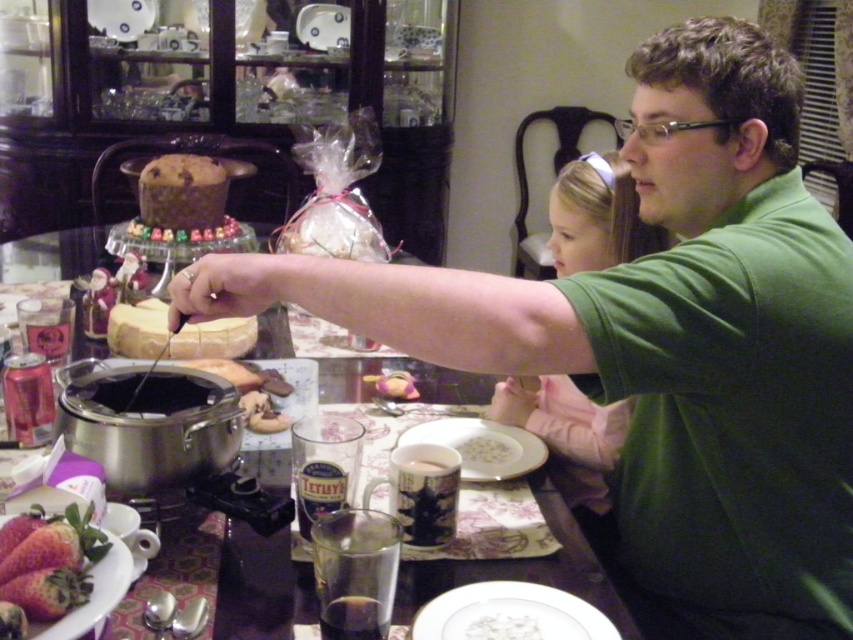
Question: Does white ceramic mug at center appear on the left side of white matte plate at center?

Choices:
 (A) yes
 (B) no

Answer: (A)

Question: Which of the following is the farthest from the observer?

Choices:
 (A) white ceramic mug at center
 (B) white matte plate at center
 (C) matte silver pot at center
 (D) metallic silver pot at center

Answer: (B)

Question: Estimate the real-world distances between objects in this image. Which object is closer to the matte silver pot at center?

Choices:
 (A) ripe red strawberries at lower left
 (B) white matte plate at center
 (C) white matte plate at lower center

Answer: (B)

Question: Which object is closer to the camera taking this photo?

Choices:
 (A) chocolate cake at center
 (B) white matte plate at center

Answer: (B)

Question: Can you confirm if chocolate cake at center is wider than white ceramic mug at center?

Choices:
 (A) yes
 (B) no

Answer: (A)

Question: Does white matte plate at lower center have a greater width compared to white cheese at center?

Choices:
 (A) no
 (B) yes

Answer: (A)